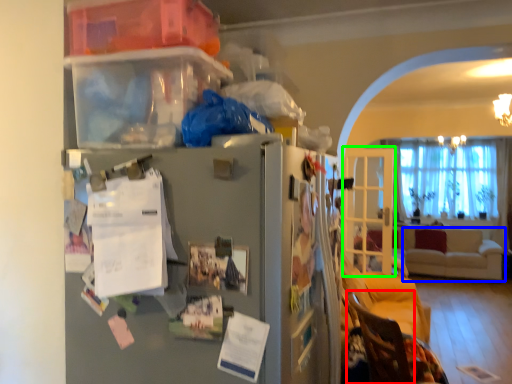
Question: Which is nearer to the armchair (highlighted by a red box)? studio couch (highlighted by a blue box) or glass door (highlighted by a green box).

Choices:
 (A) studio couch
 (B) glass door

Answer: (B)